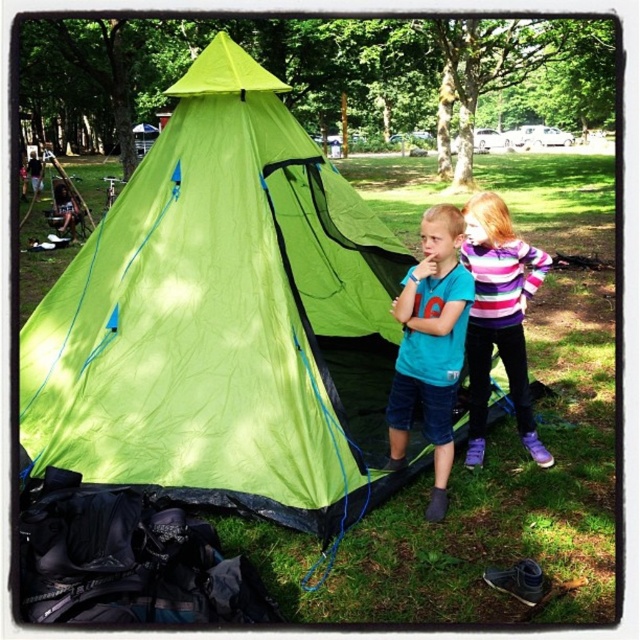
Does teal matte shirt at center appear on the right side of striped sweater at center?

Incorrect, teal matte shirt at center is not on the right side of striped sweater at center.

Who is higher up, teal matte shirt at center or striped sweater at center?

striped sweater at center is higher up.

Is point (438, 516) positioned in front of point (508, 243)?

Yes, it is in front of point (508, 243).

Identify the location of teal matte shirt at center. (429, 346).

Is green fabric tent at center taller than striped sweater at center?

Indeed, green fabric tent at center has a greater height compared to striped sweater at center.

At what (x,y) coordinates should I click in order to perform the action: click on green fabric tent at center. Please return your answer as a coordinate pair (x, y). The image size is (640, 640). Looking at the image, I should click on (225, 317).

Find the location of a particular element. The image size is (640, 640). green fabric tent at center is located at coordinates point(225,317).

Does green fabric tent at center have a greater width compared to teal matte shirt at center?

Yes.

Can you confirm if green fabric tent at center is positioned below teal matte shirt at center?

No.

Is point (54, 337) positioned before point (410, 292)?

No, (54, 337) is further to viewer.

Find the location of a particular element. green fabric tent at center is located at coordinates (225, 317).